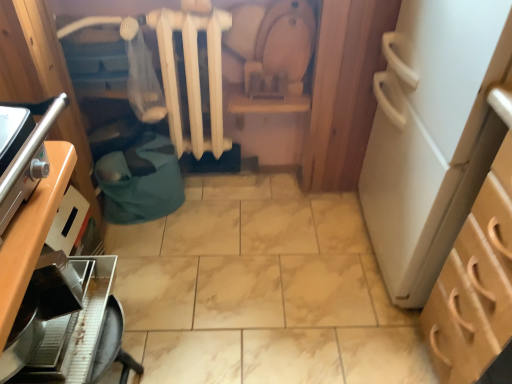
The height and width of the screenshot is (384, 512). Identify the location of metallic silver coffee maker at lower left. (66, 324).

Where is `wooden cabinet at left, the second cabinetry viewed from the right`? wooden cabinet at left, the second cabinetry viewed from the right is located at coordinates (42, 80).

Measure the distance between wooden cabinet at left, the second cabinetry viewed from the right, and camera.

1.05 meters.

Describe the element at coordinates (475, 284) in the screenshot. I see `light brown wood cabinet at right, which is counted as the first cabinetry, starting from the right` at that location.

In order to face light brown wood cabinet at right, the second cabinetry viewed from the left, should I rotate leftwards or rightwards?

To align with it, rotate right about 33.145°.

I want to click on white matte radiator at center, so click(x=192, y=76).

Identify the location of metallic silver coffee maker at lower left. click(66, 324).

Between metallic silver coffee maker at lower left and light brown wood cabinet at right, which is counted as the first cabinetry, starting from the right, which one is positioned behind?

metallic silver coffee maker at lower left is further away from the camera.

Between metallic silver coffee maker at lower left and light brown wood cabinet at right, which is counted as the first cabinetry, starting from the right, which one appears on the right side from the viewer's perspective?

Positioned to the right is light brown wood cabinet at right, which is counted as the first cabinetry, starting from the right.

Is metallic silver coffee maker at lower left directly adjacent to light brown wood cabinet at right, the second cabinetry viewed from the left?

No, metallic silver coffee maker at lower left is not in contact with light brown wood cabinet at right, the second cabinetry viewed from the left.

From the image's perspective, which cabinetry is the 1st one above the metallic silver coffee maker at lower left? Please provide its 2D coordinates.

[(475, 284)]

Are wooden cabinet at left, marked as the first cabinetry in a left-to-right arrangement, and white matte radiator at center located far from each other?

Actually, wooden cabinet at left, marked as the first cabinetry in a left-to-right arrangement, and white matte radiator at center are a little close together.

The width and height of the screenshot is (512, 384). I want to click on cabinetry located above the white matte radiator at center (from a real-world perspective), so click(x=42, y=80).

Does wooden cabinet at left, marked as the first cabinetry in a left-to-right arrangement, appear on the left side of white matte radiator at center?

Yes.

Considering the sizes of wooden cabinet at left, the second cabinetry viewed from the right, and metallic silver coffee maker at lower left in the image, is wooden cabinet at left, the second cabinetry viewed from the right, taller or shorter than metallic silver coffee maker at lower left?

Considering their sizes, wooden cabinet at left, the second cabinetry viewed from the right, has less height than metallic silver coffee maker at lower left.

This screenshot has width=512, height=384. In order to click on cabinetry that is the 2nd object located in front of the metallic silver coffee maker at lower left in this screenshot , I will do `click(42, 80)`.

Which is farther from the camera, (28, 93) or (46, 353)?

The point (28, 93) is more distant.

Can you tell me how much wooden cabinet at left, marked as the first cabinetry in a left-to-right arrangement, and metallic silver coffee maker at lower left differ in facing direction?

There is a 4.78-degree angle between the facing directions of wooden cabinet at left, marked as the first cabinetry in a left-to-right arrangement, and metallic silver coffee maker at lower left.

From a real-world perspective, is white matte radiator at center positioned above or below metallic silver coffee maker at lower left?

white matte radiator at center is above metallic silver coffee maker at lower left.

Which object is more forward, white matte radiator at center or metallic silver coffee maker at lower left?

Positioned in front is metallic silver coffee maker at lower left.

At what (x,y) coordinates should I click in order to perform the action: click on radiator behind the metallic silver coffee maker at lower left. Please return your answer as a coordinate pair (x, y). This screenshot has width=512, height=384. Looking at the image, I should click on (192, 76).

How many degrees apart are the facing directions of white matte radiator at center and metallic silver coffee maker at lower left?

white matte radiator at center and metallic silver coffee maker at lower left are facing 90.6 degrees away from each other.

Can you confirm if light brown wood cabinet at right, which is counted as the first cabinetry, starting from the right, is positioned to the right of white matte radiator at center?

Correct, you'll find light brown wood cabinet at right, which is counted as the first cabinetry, starting from the right, to the right of white matte radiator at center.

From the image's perspective, is light brown wood cabinet at right, the second cabinetry viewed from the left, on white matte radiator at center?

No, from the image's perspective, light brown wood cabinet at right, the second cabinetry viewed from the left, is not above white matte radiator at center.

Is point (496, 344) in front of point (193, 34)?

That is True.

From a real-world perspective, is light brown wood cabinet at right, which is counted as the first cabinetry, starting from the right, on top of white matte radiator at center?

No, from a real-world perspective, light brown wood cabinet at right, which is counted as the first cabinetry, starting from the right, is not over white matte radiator at center

From a real-world perspective, is metallic silver coffee maker at lower left under white matte radiator at center?

Yes, from a real-world perspective, metallic silver coffee maker at lower left is below white matte radiator at center.

Is metallic silver coffee maker at lower left at the right side of white matte radiator at center?

No.

Is white matte radiator at center at the back of metallic silver coffee maker at lower left?

metallic silver coffee maker at lower left is not turned away from white matte radiator at center.

Is white matte radiator at center wider or thinner than wooden cabinet at left, marked as the first cabinetry in a left-to-right arrangement?

Considering their sizes, white matte radiator at center looks slimmer than wooden cabinet at left, marked as the first cabinetry in a left-to-right arrangement.

From the image's perspective, which one is positioned lower, white matte radiator at center or wooden cabinet at left, marked as the first cabinetry in a left-to-right arrangement?

wooden cabinet at left, marked as the first cabinetry in a left-to-right arrangement, is shown below in the image.

From the picture: Between white matte radiator at center and wooden cabinet at left, the second cabinetry viewed from the right, which one has less height?

Standing shorter between the two is wooden cabinet at left, the second cabinetry viewed from the right.

How different are the orientations of white matte radiator at center and wooden cabinet at left, the second cabinetry viewed from the right, in degrees?

The facing directions of white matte radiator at center and wooden cabinet at left, the second cabinetry viewed from the right, are 85.8 degrees apart.

Where is `the 1st cabinetry in front of the metallic silver coffee maker at lower left, counting from the anchor's position`? the 1st cabinetry in front of the metallic silver coffee maker at lower left, counting from the anchor's position is located at coordinates (475, 284).

This screenshot has height=384, width=512. What are the coordinates of `the 1st cabinetry below the white matte radiator at center (from the image's perspective)` in the screenshot? It's located at (42, 80).

From the image, which object appears to be farther from light brown wood cabinet at right, which is counted as the first cabinetry, starting from the right, white matte radiator at center or wooden cabinet at left, marked as the first cabinetry in a left-to-right arrangement?

The object further to light brown wood cabinet at right, which is counted as the first cabinetry, starting from the right, is wooden cabinet at left, marked as the first cabinetry in a left-to-right arrangement.

Considering their positions, is light brown wood cabinet at right, which is counted as the first cabinetry, starting from the right, positioned closer to wooden cabinet at left, marked as the first cabinetry in a left-to-right arrangement, than white matte radiator at center?

white matte radiator at center is positioned closer to the anchor wooden cabinet at left, marked as the first cabinetry in a left-to-right arrangement.

Looking at the image, which one is located closer to wooden cabinet at left, marked as the first cabinetry in a left-to-right arrangement, white matte radiator at center or light brown wood cabinet at right, which is counted as the first cabinetry, starting from the right?

Based on the image, white matte radiator at center appears to be nearer to wooden cabinet at left, marked as the first cabinetry in a left-to-right arrangement.

Which object lies nearer to the anchor point light brown wood cabinet at right, the second cabinetry viewed from the left, metallic silver coffee maker at lower left or wooden cabinet at left, the second cabinetry viewed from the right?

The object closer to light brown wood cabinet at right, the second cabinetry viewed from the left, is metallic silver coffee maker at lower left.

Looking at the image, which one is located closer to metallic silver coffee maker at lower left, wooden cabinet at left, the second cabinetry viewed from the right, or light brown wood cabinet at right, which is counted as the first cabinetry, starting from the right?

wooden cabinet at left, the second cabinetry viewed from the right, is closer to metallic silver coffee maker at lower left.

When comparing their distances from light brown wood cabinet at right, which is counted as the first cabinetry, starting from the right, does white matte radiator at center or metallic silver coffee maker at lower left seem further?

Among the two, white matte radiator at center is located further to light brown wood cabinet at right, which is counted as the first cabinetry, starting from the right.

Which object lies nearer to the anchor point light brown wood cabinet at right, the second cabinetry viewed from the left, metallic silver coffee maker at lower left or white matte radiator at center?

Based on the image, metallic silver coffee maker at lower left appears to be nearer to light brown wood cabinet at right, the second cabinetry viewed from the left.

Based on their spatial positions, is light brown wood cabinet at right, which is counted as the first cabinetry, starting from the right, or metallic silver coffee maker at lower left closer to wooden cabinet at left, marked as the first cabinetry in a left-to-right arrangement?

The object closer to wooden cabinet at left, marked as the first cabinetry in a left-to-right arrangement, is metallic silver coffee maker at lower left.

Image resolution: width=512 pixels, height=384 pixels. Find the location of `kitchen appliance positioned between wooden cabinet at left, the second cabinetry viewed from the right, and white matte radiator at center from near to far`. kitchen appliance positioned between wooden cabinet at left, the second cabinetry viewed from the right, and white matte radiator at center from near to far is located at coordinates pos(66,324).

Image resolution: width=512 pixels, height=384 pixels. What are the coordinates of `radiator between wooden cabinet at left, the second cabinetry viewed from the right, and light brown wood cabinet at right, the second cabinetry viewed from the left, from left to right` in the screenshot? It's located at [x=192, y=76].

At what (x,y) coordinates should I click in order to perform the action: click on radiator between metallic silver coffee maker at lower left and light brown wood cabinet at right, which is counted as the first cabinetry, starting from the right, in the horizontal direction. Please return your answer as a coordinate pair (x, y). The height and width of the screenshot is (384, 512). Looking at the image, I should click on (192, 76).

You are a GUI agent. You are given a task and a screenshot of the screen. Output one action in this format:
    pyautogui.click(x=<x>, y=<y>)
    Task: Click on the cabinetry between metallic silver coffee maker at lower left and light brown wood cabinet at right, which is counted as the first cabinetry, starting from the right, in the horizontal direction
    The height and width of the screenshot is (384, 512).
    Given the screenshot: What is the action you would take?
    pyautogui.click(x=42, y=80)